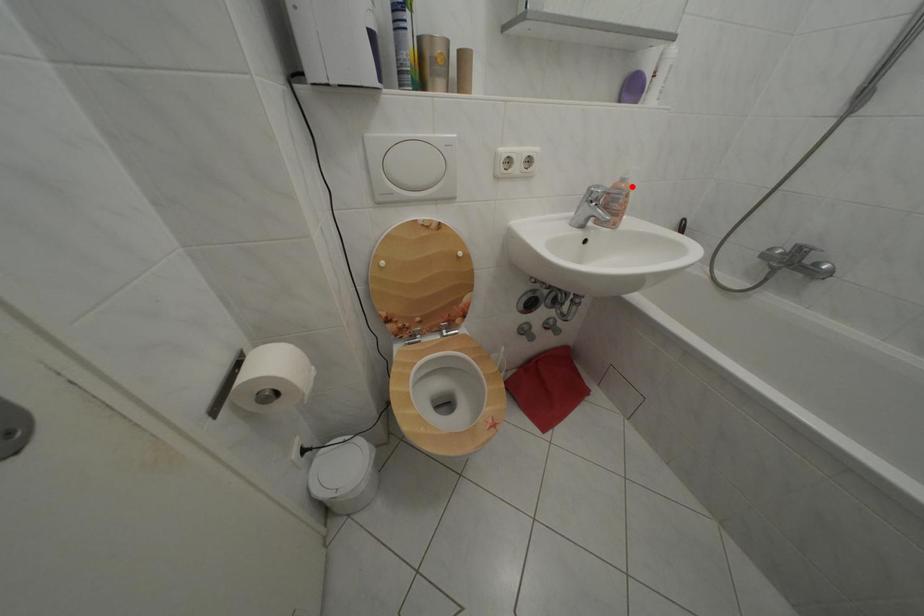
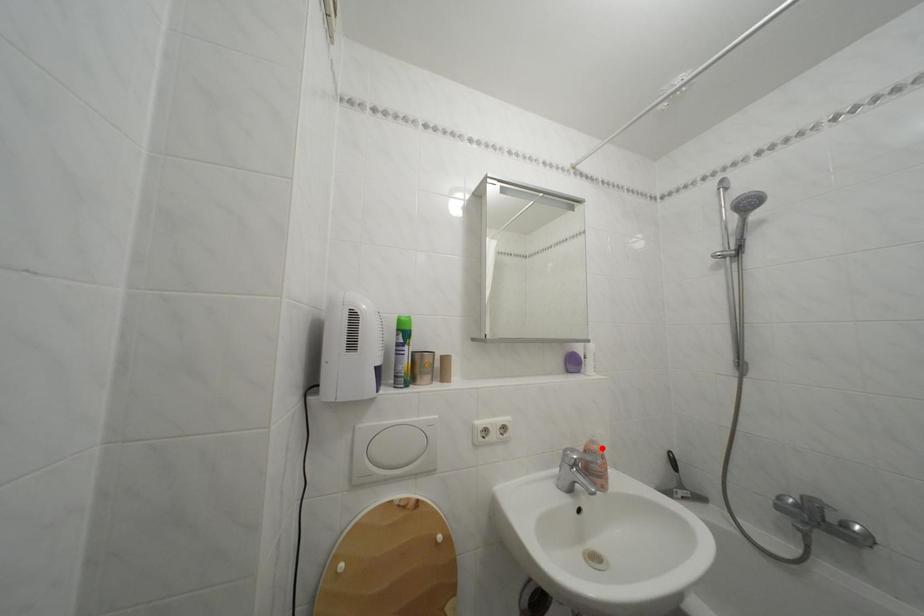
I am providing you with two images of the same scene from different viewpoints. A red point is marked on the first image and another point is marked on the second image. Is the marked point in image1 the same physical position as the marked point in image2?

Yes